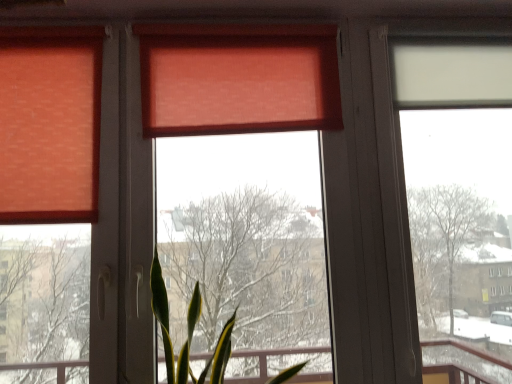
Question: Can you confirm if matte orange curtain at upper center is positioned to the left of transparent plastic window screen at right, which is the 2th window screen from left to right?

Choices:
 (A) no
 (B) yes

Answer: (B)

Question: Is matte orange curtain at upper center thinner than transparent plastic window screen at right, which is the 2th window screen from left to right?

Choices:
 (A) no
 (B) yes

Answer: (A)

Question: Is matte orange curtain at upper center wider than transparent plastic window screen at right, which is the 1th window screen from right to left?

Choices:
 (A) no
 (B) yes

Answer: (B)

Question: Is matte orange curtain at upper center not within transparent plastic window screen at right, which is the 1th window screen from right to left?

Choices:
 (A) no
 (B) yes

Answer: (B)

Question: From the image's perspective, is matte orange curtain at upper center over transparent plastic window screen at right, which is the 1th window screen from right to left?

Choices:
 (A) no
 (B) yes

Answer: (B)

Question: Considering the positions of matte orange curtain at upper center and transparent plastic window screen at right, which is the 2th window screen from left to right, in the image, is matte orange curtain at upper center taller or shorter than transparent plastic window screen at right, which is the 2th window screen from left to right,?

Choices:
 (A) tall
 (B) short

Answer: (B)

Question: From a real-world perspective, is matte orange curtain at upper center above or below transparent plastic window screen at right, which is the 1th window screen from right to left?

Choices:
 (A) above
 (B) below

Answer: (A)

Question: Considering the positions of point (45, 46) and point (456, 377), is point (45, 46) closer or farther from the camera than point (456, 377)?

Choices:
 (A) closer
 (B) farther

Answer: (A)

Question: Relative to transparent plastic window screen at right, which is the 2th window screen from left to right, is matte orange curtain at upper center in front or behind?

Choices:
 (A) behind
 (B) front

Answer: (B)

Question: Considering the positions of transparent plastic window screen at right, which is the 2th window screen from left to right, and matte orange window screen at center, which is the second window screen from right to left, in the image, is transparent plastic window screen at right, which is the 2th window screen from left to right, wider or thinner than matte orange window screen at center, which is the second window screen from right to left,?

Choices:
 (A) thin
 (B) wide

Answer: (A)

Question: Considering the positions of point [x=496, y=236] and point [x=261, y=102], is point [x=496, y=236] closer or farther from the camera than point [x=261, y=102]?

Choices:
 (A) farther
 (B) closer

Answer: (A)

Question: From a real-world perspective, is transparent plastic window screen at right, which is the 2th window screen from left to right, physically located above or below matte orange window screen at center, which is the second window screen from right to left?

Choices:
 (A) below
 (B) above

Answer: (A)

Question: From the image's perspective, is transparent plastic window screen at right, which is the 2th window screen from left to right, above or below matte orange window screen at center, which is the second window screen from right to left?

Choices:
 (A) below
 (B) above

Answer: (B)

Question: Considering the positions of point (74, 157) and point (178, 34), is point (74, 157) closer or farther from the camera than point (178, 34)?

Choices:
 (A) closer
 (B) farther

Answer: (A)

Question: In terms of height, does matte orange curtain at upper center look taller or shorter compared to matte orange window screen at center, which is the second window screen from right to left?

Choices:
 (A) short
 (B) tall

Answer: (A)